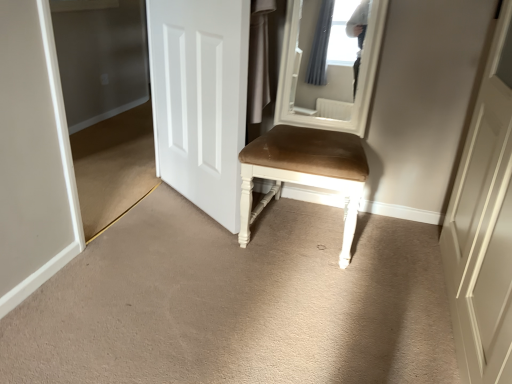
Question: Considering the relative sizes of transparent glass door at left and suede-like brown chair at center in the image provided, is transparent glass door at left shorter than suede-like brown chair at center?

Choices:
 (A) no
 (B) yes

Answer: (A)

Question: Is transparent glass door at left at the left side of suede-like brown chair at center?

Choices:
 (A) yes
 (B) no

Answer: (A)

Question: Is transparent glass door at left located outside suede-like brown chair at center?

Choices:
 (A) yes
 (B) no

Answer: (A)

Question: Does transparent glass door at left have a smaller size compared to suede-like brown chair at center?

Choices:
 (A) no
 (B) yes

Answer: (B)

Question: Is transparent glass door at left oriented away from suede-like brown chair at center?

Choices:
 (A) no
 (B) yes

Answer: (A)

Question: Visually, is suede-like brown chair at center positioned to the left or to the right of white matte door at center?

Choices:
 (A) right
 (B) left

Answer: (A)

Question: Is suede-like brown chair at center inside the boundaries of white matte door at center, or outside?

Choices:
 (A) inside
 (B) outside

Answer: (B)

Question: From a real-world perspective, relative to white matte door at center, is suede-like brown chair at center vertically above or below?

Choices:
 (A) below
 (B) above

Answer: (A)

Question: From the image's perspective, is suede-like brown chair at center positioned above or below white matte door at center?

Choices:
 (A) above
 (B) below

Answer: (B)

Question: Is white matte door at center taller or shorter than transparent glass door at left?

Choices:
 (A) tall
 (B) short

Answer: (B)

Question: Is white matte door at center inside or outside of transparent glass door at left?

Choices:
 (A) inside
 (B) outside

Answer: (B)

Question: Is white matte door at center in front of or behind transparent glass door at left in the image?

Choices:
 (A) front
 (B) behind

Answer: (B)

Question: Considering the positions of point (174, 132) and point (104, 152), is point (174, 132) closer or farther from the camera than point (104, 152)?

Choices:
 (A) closer
 (B) farther

Answer: (A)

Question: Do you think white matte door at center is within suede-like brown chair at center, or outside of it?

Choices:
 (A) inside
 (B) outside

Answer: (B)

Question: From a real-world perspective, is white matte door at center physically located above or below suede-like brown chair at center?

Choices:
 (A) below
 (B) above

Answer: (B)